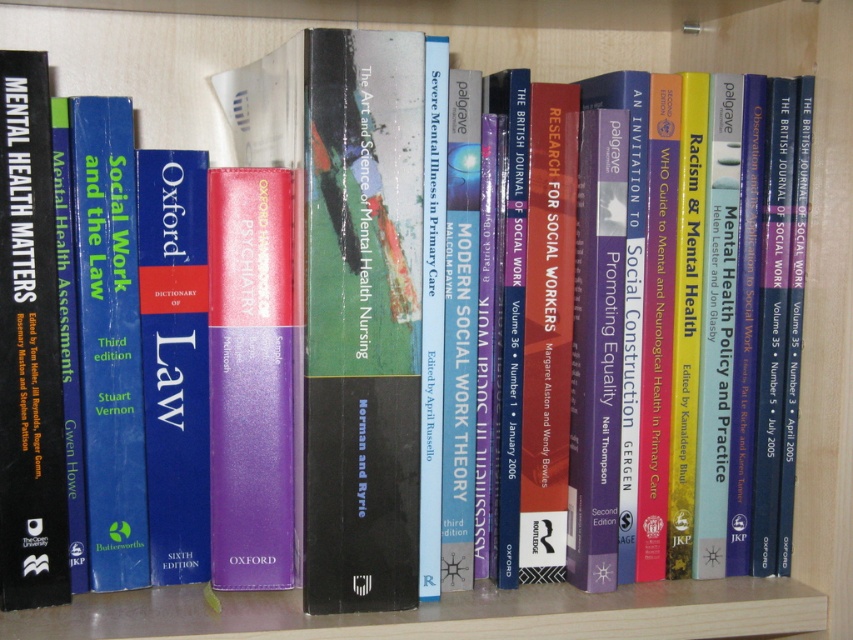
Based on the photo, you are organizing books on a shelf and need to place a new book between the hardcover book at center and the blue hardcover dictionary of law at center. Based on their positions, where should the new book be placed?

The new book should be placed between the hardcover book at center and the blue hardcover dictionary of law at center. Since the hardcover book at center is located above the blue hardcover dictionary of law at center, the new book can be placed either between them vertically or horizontally depending on the shelf space available.

You are a librarian organizing books on a shelf. You notice two points marked on the shelf at coordinates point (x=268, y=557) and point (x=54, y=460). Which point is closer to you as you face the shelf?

Point (x=54, y=460) is closer to you because it is nearer to the camera position compared to point (x=268, y=557), which is further away.